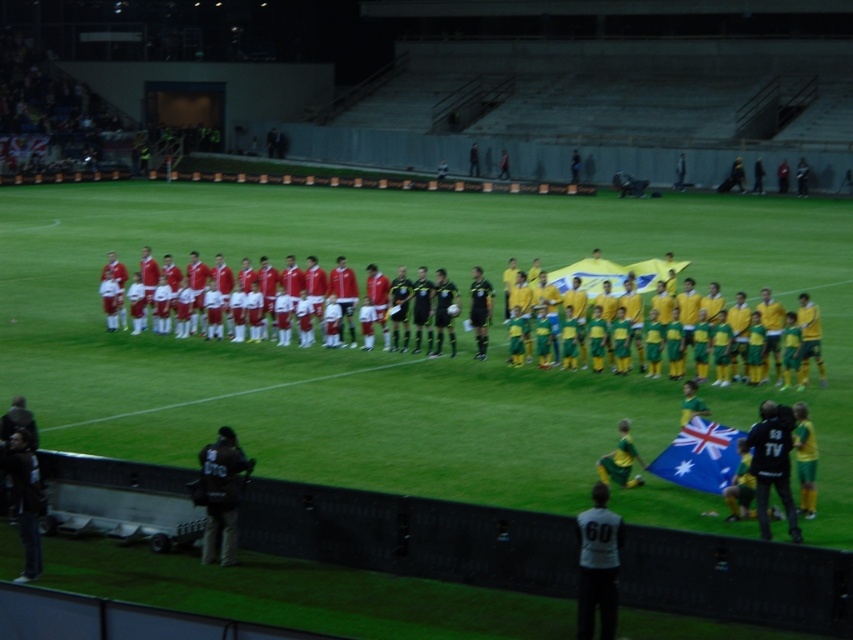
Between blue fabric flag at lower right and matte red uniform at center, which one is positioned higher?

matte red uniform at center is above.

Between point (659, 476) and point (589, 273), which one is positioned behind?

Positioned behind is point (589, 273).

Does point (718, 486) come in front of point (149, 296)?

Yes.

What are the coordinates of `blue fabric flag at lower right` in the screenshot? It's located at (699, 456).